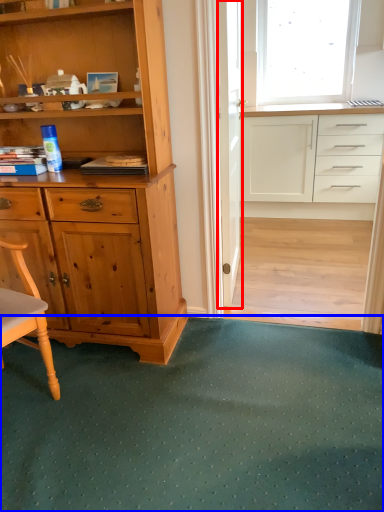
Question: Which object appears closest to the camera in this image, screen door (highlighted by a red box) or doormat (highlighted by a blue box)?

Choices:
 (A) screen door
 (B) doormat

Answer: (B)